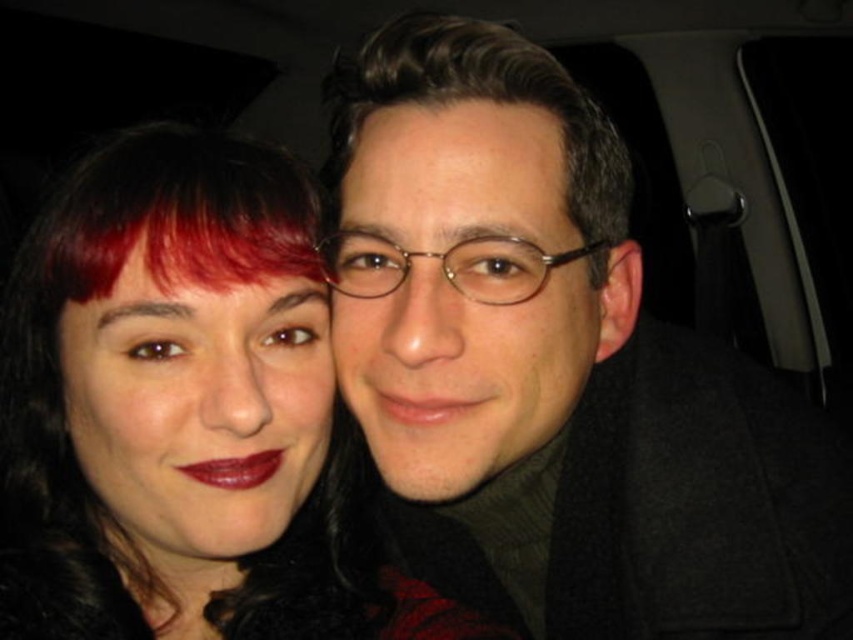
Question: Does matte black coat at center appear on the right side of dark brown smooth hair at center?

Choices:
 (A) no
 (B) yes

Answer: (B)

Question: Can you confirm if dark brown smooth hair at center is positioned below shiny red lipstick at center?

Choices:
 (A) yes
 (B) no

Answer: (B)

Question: Which of the following is the closest to the observer?

Choices:
 (A) matte red lipstick at center
 (B) matte black hair at center
 (C) matte black coat at center

Answer: (C)

Question: Is matte black hair at center in front of matte red lipstick at center?

Choices:
 (A) yes
 (B) no

Answer: (A)

Question: Which of the following is the farthest from the observer?

Choices:
 (A) dark brown smooth hair at center
 (B) matte black hair at center
 (C) matte black coat at center
 (D) matte red lipstick at center

Answer: (A)

Question: Which point is closer to the camera?

Choices:
 (A) shiny red lipstick at center
 (B) matte black coat at center

Answer: (B)